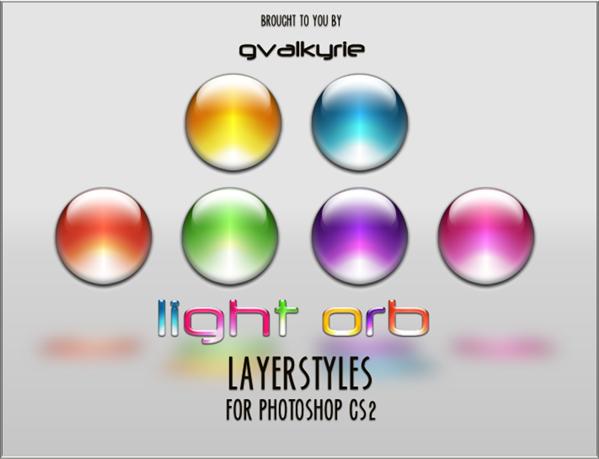
You are a GUI agent. You are given a task and a screenshot of the screen. Output one action in this format:
    pyautogui.click(x=<x>, y=<y>)
    Task: Click on the light orbs
    The image size is (599, 459).
    Given the screenshot: What is the action you would take?
    pyautogui.click(x=231, y=101), pyautogui.click(x=355, y=106), pyautogui.click(x=104, y=213), pyautogui.click(x=238, y=213), pyautogui.click(x=355, y=219), pyautogui.click(x=489, y=223)